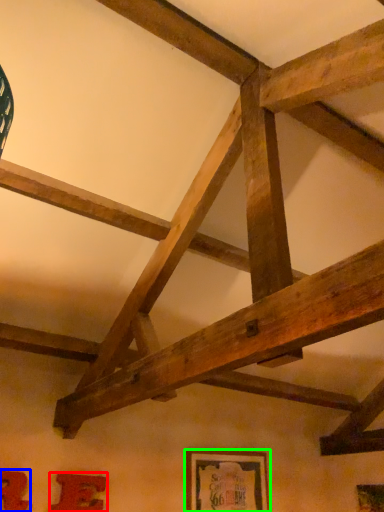
Question: Considering the real-world distances, which object is farthest from picture frame (highlighted by a red box)? picture frame (highlighted by a blue box) or picture frame (highlighted by a green box)?

Choices:
 (A) picture frame
 (B) picture frame

Answer: (B)